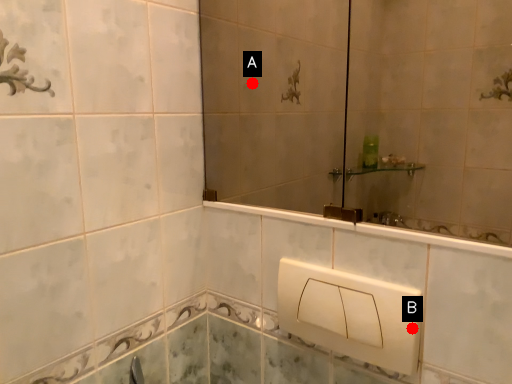
Question: Two points are circled on the image, labeled by A and B beside each circle. Which of the following is the farthest from the observer?

Choices:
 (A) A is further
 (B) B is further

Answer: (A)